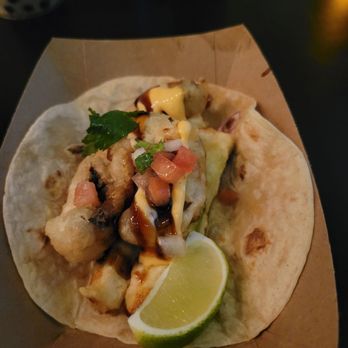
In order to click on grease stain in this screenshot , I will do tap(222, 45).